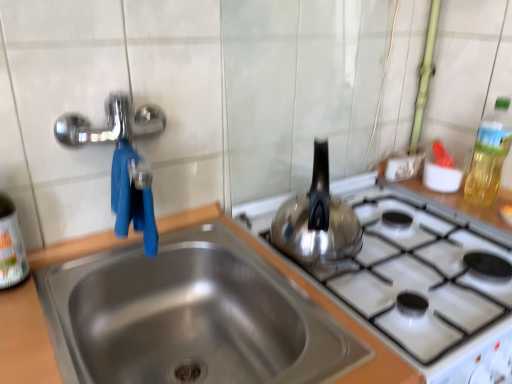
Question: From a real-world perspective, relative to shiny metallic kettle at right, is translucent yellow bottle at upper right, placed as the 1th bottle when sorted from right to left, vertically above or below?

Choices:
 (A) above
 (B) below

Answer: (A)

Question: Considering the positions of translucent yellow bottle at upper right, the second bottle when ordered from front to back, and shiny metallic kettle at right in the image, is translucent yellow bottle at upper right, the second bottle when ordered from front to back, taller or shorter than shiny metallic kettle at right?

Choices:
 (A) short
 (B) tall

Answer: (B)

Question: Which object is the closest to the stainless steel sink at center?

Choices:
 (A) shiny metallic kettle at right
 (B) translucent yellow bottle at upper right, arranged as the 1th bottle when viewed from the back
 (C) white plastic bottle at left, the 1th bottle in the front-to-back sequence

Answer: (A)

Question: Which is farther from the translucent yellow bottle at upper right, which is the 2th bottle in left-to-right order?

Choices:
 (A) shiny metallic kettle at right
 (B) stainless steel sink at center
 (C) white plastic bottle at left, which appears as the 2th bottle when viewed from the back

Answer: (C)